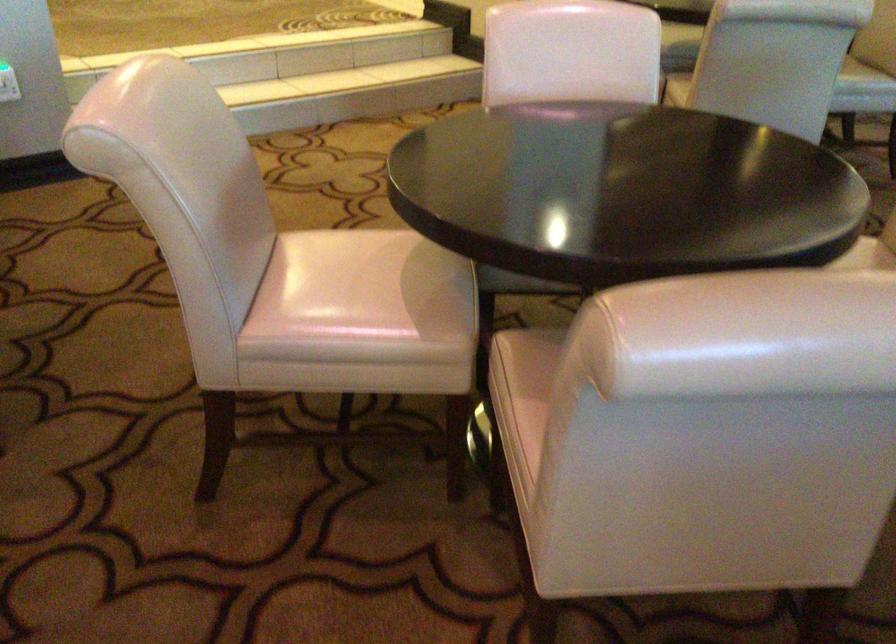
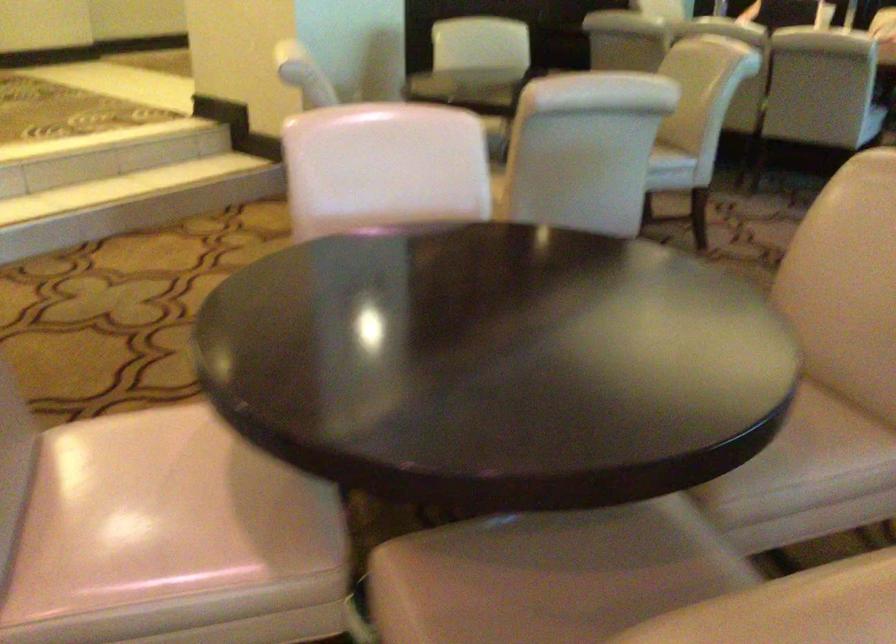
Question: The camera is either moving clockwise (left) or counter-clockwise (right) around the object. The first image is from the beginning of the video and the second image is from the end. Is the camera moving left or right when shooting the video?

Choices:
 (A) Left
 (B) Right

Answer: (A)